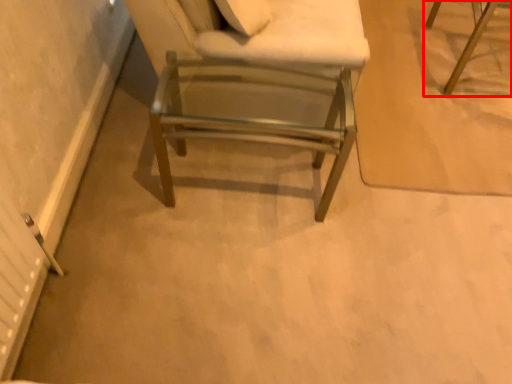
Question: From the image's perspective, what is the correct spatial positioning of chair (annotated by the red box) in reference to chair?

Choices:
 (A) below
 (B) above

Answer: (B)